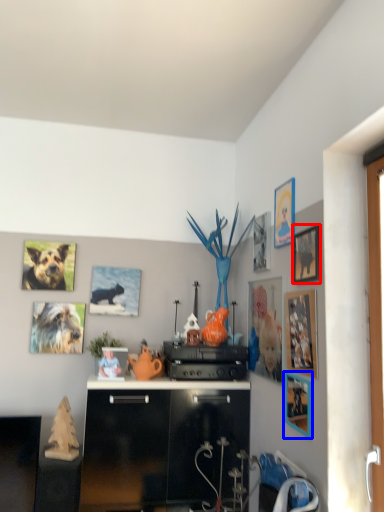
Question: Which point is further to the camera, picture frame (highlighted by a red box) or picture frame (highlighted by a blue box)?

Choices:
 (A) picture frame
 (B) picture frame

Answer: (B)